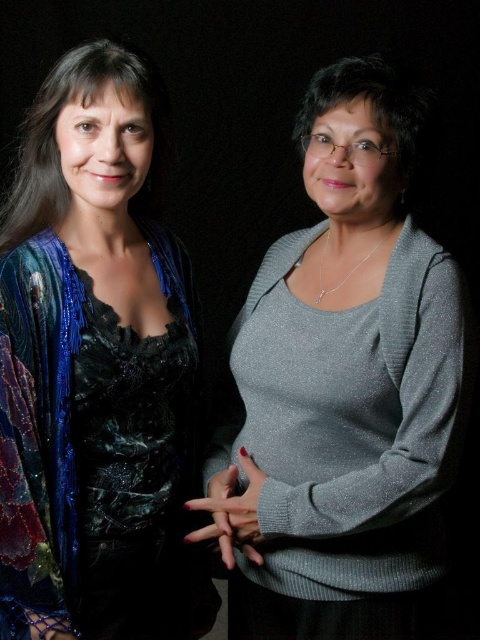
You are a fashion designer trying to decide which piece to feature in your upcoming collection. You have two options from the image provided. The shiny silver sweater at center and the shiny blue sequined jacket at left. Based on their sizes, which one would you choose if you want to emphasize grandeur and presence?

The shiny silver sweater at center is larger in size than the shiny blue sequined jacket at left, so choosing the shiny silver sweater at center would better emphasize grandeur and presence due to its larger size.

You are a tailor who needs to measure the space between two garments. You see the shiny silver sweater at center and the shiny blue sequined jacket at left. Can you fit a 5 inch wide measuring tape between them?

The distance between the shiny silver sweater at center and the shiny blue sequined jacket at left is 10.04 inches. Since the measuring tape is 5 inches wide, it can fit between them as there is enough space.